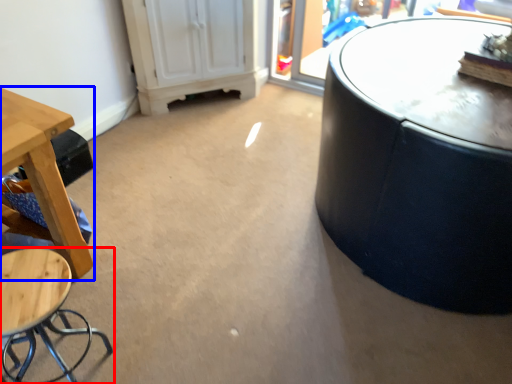
Question: Among these objects, which one is farthest to the camera, stool (highlighted by a red box) or table (highlighted by a blue box)?

Choices:
 (A) stool
 (B) table

Answer: (B)